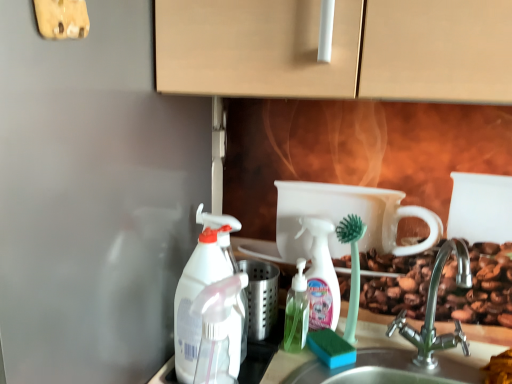
Question: Is translucent plastic spray bottle at center, which appears as the third cleaning product when viewed from the front, inside the boundaries of satin nickel faucet at lower right, or outside?

Choices:
 (A) inside
 (B) outside

Answer: (B)

Question: Would you say translucent plastic spray bottle at center, positioned as the third cleaning product in left-to-right order, is to the left or to the right of satin nickel faucet at lower right in the picture?

Choices:
 (A) right
 (B) left

Answer: (B)

Question: Which object is positioned farthest from the satin nickel faucet at lower right?

Choices:
 (A) green translucent soap dispenser at center
 (B) translucent plastic spray bottle at center, which appears as the third cleaning product when viewed from the front
 (C) transparent plastic spray bottle at left, acting as the 3th cleaning product starting from the back
 (D) white plastic spray bottle at left, the 2th cleaning product viewed from the back

Answer: (D)

Question: Which object is positioned farthest from the transparent plastic spray bottle at left, marked as the second cleaning product in a left-to-right arrangement?

Choices:
 (A) white plastic spray bottle at left, the first cleaning product viewed from the left
 (B) green translucent soap dispenser at center
 (C) translucent plastic spray bottle at center, which appears as the third cleaning product when viewed from the front
 (D) satin nickel faucet at lower right

Answer: (D)